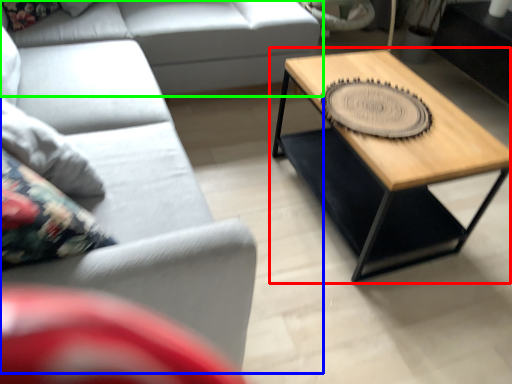
Question: Which object is positioned closest to coffee table (highlighted by a red box)? Select from studio couch (highlighted by a blue box) and studio couch (highlighted by a green box).

Choices:
 (A) studio couch
 (B) studio couch

Answer: (A)